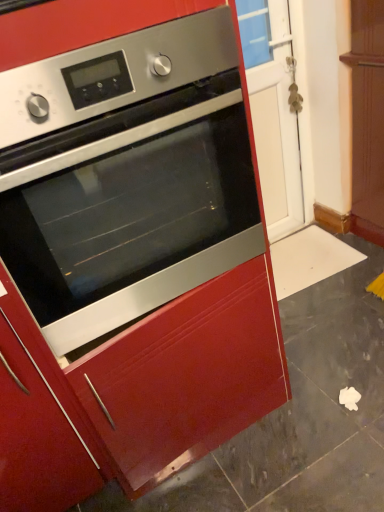
What do you see at coordinates (186, 376) in the screenshot? This screenshot has height=512, width=384. I see `glossy wood drawer at center` at bounding box center [186, 376].

At what (x,y) coordinates should I click in order to perform the action: click on stainless steel oven at center. Please return your answer as a coordinate pair (x, y). Looking at the image, I should click on (126, 177).

This screenshot has height=512, width=384. Identify the location of drawer located below the stainless steel oven at center (from the image's perspective). (186, 376).

Which object is further away from the camera, glossy wood drawer at center or stainless steel oven at center?

glossy wood drawer at center.

Locate an element on the screen. glass door that appears below the stainless steel oven at center (from a real-world perspective) is located at coordinates (273, 112).

Is stainless steel oven at center far from transparent glass door at center?

stainless steel oven at center is far away from transparent glass door at center.

Is point (216, 74) positioned in front of point (286, 191)?

That is True.

From the image's perspective, is stainless steel oven at center on transparent glass door at center?

Incorrect, from the image's perspective, stainless steel oven at center is lower than transparent glass door at center.

From a real-world perspective, which object stands above the other?

From a 3D spatial view, transparent glass door at center is above.

Is transparent glass door at center beside glossy wood drawer at center?

No, transparent glass door at center is not with glossy wood drawer at center.

Is transparent glass door at center outside of stainless steel oven at center?

Indeed, transparent glass door at center is completely outside stainless steel oven at center.

Does transparent glass door at center have a greater width compared to stainless steel oven at center?

Incorrect, the width of transparent glass door at center does not surpass that of stainless steel oven at center.

Is transparent glass door at center behind stainless steel oven at center?

Yes, transparent glass door at center is further from the viewer.

Based on the photo, is glossy wood drawer at center surrounding transparent glass door at center?

No, transparent glass door at center is located outside of glossy wood drawer at center.

From a real-world perspective, is glossy wood drawer at center physically below transparent glass door at center?

Yes, from a real-world perspective, glossy wood drawer at center is beneath transparent glass door at center.

Which of these two, glossy wood drawer at center or transparent glass door at center, is wider?

With larger width is glossy wood drawer at center.

Is glossy wood drawer at center oriented away from transparent glass door at center?

glossy wood drawer at center does not have its back to transparent glass door at center.

Is point (171, 298) closer or farther from the camera than point (124, 413)?

Point (171, 298) is positioned closer to the camera compared to point (124, 413).

Is stainless steel oven at center positioned with its back to glossy wood drawer at center?

No, stainless steel oven at center is not facing the opposite direction of glossy wood drawer at center.

From a real-world perspective, does stainless steel oven at center stand above glossy wood drawer at center?

Indeed, from a real-world perspective, stainless steel oven at center stands above glossy wood drawer at center.

What's the angular difference between stainless steel oven at center and glossy wood drawer at center's facing directions?

They differ by 1.29 degrees in their facing directions.

Identify the location of drawer lying behind the stainless steel oven at center. (186, 376).

Locate an element on the screen. Image resolution: width=384 pixels, height=512 pixels. glass door below the stainless steel oven at center (from a real-world perspective) is located at coordinates (273, 112).

In the scene shown: Considering their positions, is transparent glass door at center positioned further to glossy wood drawer at center than stainless steel oven at center?

transparent glass door at center is further to glossy wood drawer at center.

Looking at this image, estimate the real-world distances between objects in this image. Which object is closer to glossy wood drawer at center, stainless steel oven at center or transparent glass door at center?

stainless steel oven at center is closer to glossy wood drawer at center.

From the image, which object appears to be farther from stainless steel oven at center, transparent glass door at center or glossy wood drawer at center?

Among the two, transparent glass door at center is located further to stainless steel oven at center.

Which object lies nearer to the anchor point transparent glass door at center, glossy wood drawer at center or stainless steel oven at center?

Among the two, stainless steel oven at center is located nearer to transparent glass door at center.

Based on the photo, when comparing their distances from stainless steel oven at center, does glossy wood drawer at center or transparent glass door at center seem closer?

glossy wood drawer at center.

Considering their positions, is stainless steel oven at center positioned closer to transparent glass door at center than glossy wood drawer at center?

stainless steel oven at center is closer to transparent glass door at center.

You are a GUI agent. You are given a task and a screenshot of the screen. Output one action in this format:
    pyautogui.click(x=<x>, y=<y>)
    Task: Click on the drawer positioned between stainless steel oven at center and transparent glass door at center from near to far
    
    Given the screenshot: What is the action you would take?
    pyautogui.click(x=186, y=376)